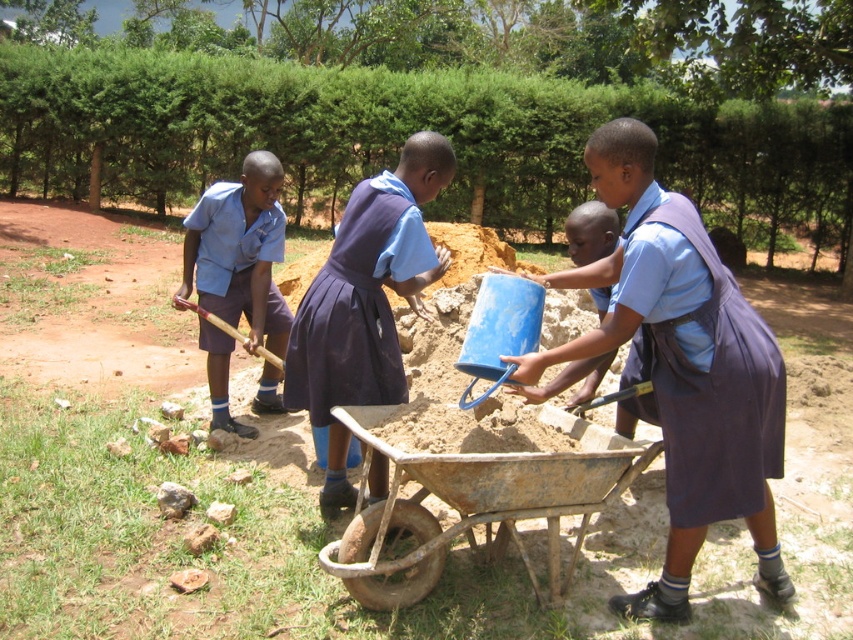
Question: Can you confirm if blue matte bucket at center is positioned to the right of purple fabric dress at center?

Choices:
 (A) no
 (B) yes

Answer: (B)

Question: Can you confirm if blue matte bucket at center is positioned below matte blue uniform at left?

Choices:
 (A) no
 (B) yes

Answer: (B)

Question: Among these objects, which one is farthest from the camera?

Choices:
 (A) blue fabric dress at center
 (B) matte blue uniform at left
 (C) purple fabric dress at center
 (D) rusty metal cart at center

Answer: (B)

Question: Which of the following is the closest to the observer?

Choices:
 (A) rusty metal cart at center
 (B) matte blue uniform at left
 (C) purple fabric dress at center

Answer: (A)

Question: Among these points, which one is farthest from the camera?

Choices:
 (A) (680, 348)
 (B) (254, 324)

Answer: (B)

Question: From the image, what is the correct spatial relationship of blue matte bucket at center in relation to purple fabric dress at center?

Choices:
 (A) left
 (B) right

Answer: (B)